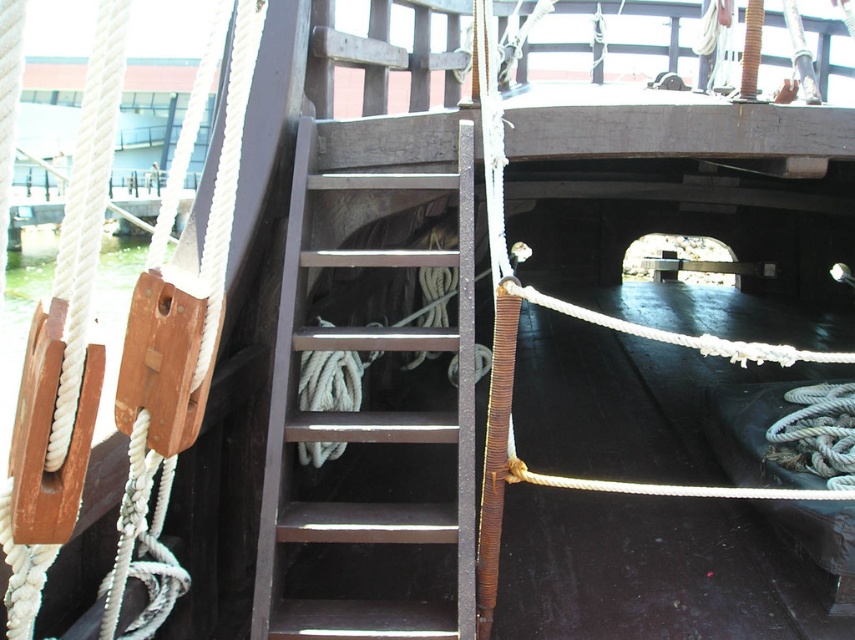
Question: Does white rope at lower right have a greater width compared to white rope at center?

Choices:
 (A) yes
 (B) no

Answer: (B)

Question: Which of the following is the closest to the observer?

Choices:
 (A) white rope at lower right
 (B) rustic wood stairs at center
 (C) white rope at center

Answer: (C)

Question: Is rustic wood stairs at center wider than white rope at center?

Choices:
 (A) yes
 (B) no

Answer: (B)

Question: Which point is farther from the camera taking this photo?

Choices:
 (A) (806, 385)
 (B) (753, 360)

Answer: (A)

Question: Is rustic wood stairs at center wider than white rope at lower right?

Choices:
 (A) no
 (B) yes

Answer: (B)

Question: Among these objects, which one is nearest to the camera?

Choices:
 (A) rustic wood stairs at center
 (B) white rope at center

Answer: (B)